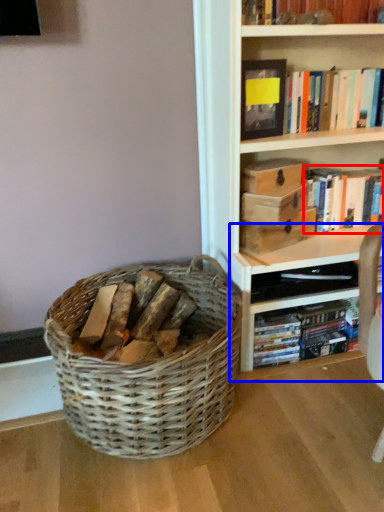
Question: Which of the following is the farthest to the observer, book (highlighted by a red box) or shelf (highlighted by a blue box)?

Choices:
 (A) book
 (B) shelf

Answer: (A)